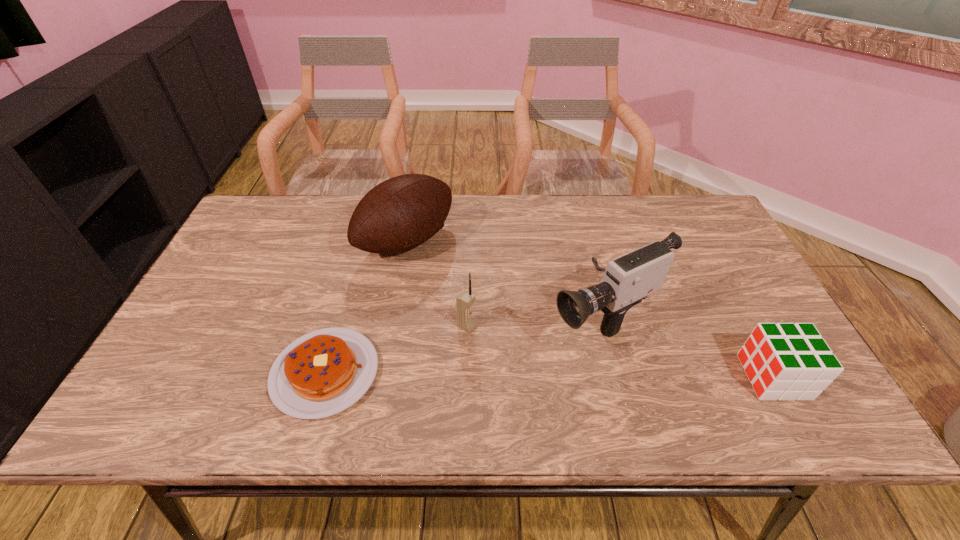
At what (x,y) coordinates should I click in order to perform the action: click on free spot on the desktop that is between the pancake and the cube and is positioned on the recording direction of the camcorder. Please return your answer as a coordinate pair (x, y). Looking at the image, I should click on (484, 374).

Identify the location of vacant space on the desktop that is between the pancake and the rightmost object and is positioned on the front of the third tallest object, where the keypad is located. This screenshot has width=960, height=540. click(552, 375).

Where is `free space on the desktop that is between the shortest object and the cube and is positioned on the laces of the football`? free space on the desktop that is between the shortest object and the cube and is positioned on the laces of the football is located at coordinates (597, 375).